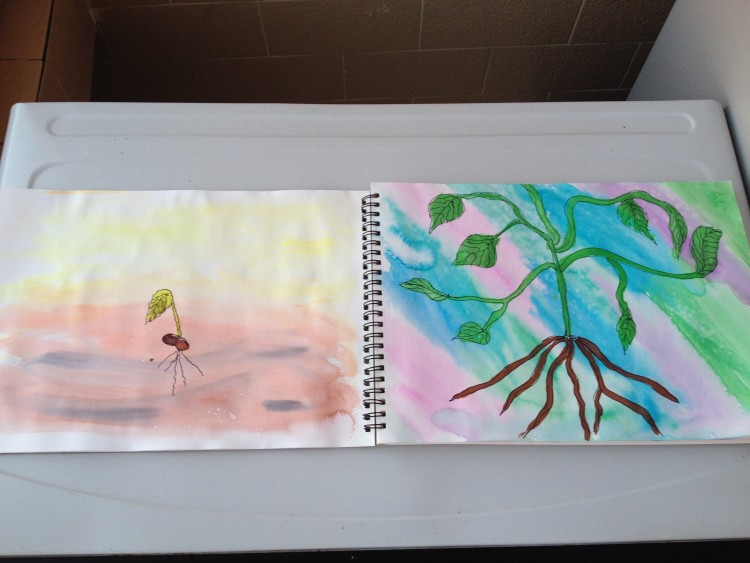
Locate an element on the screen. The width and height of the screenshot is (750, 563). wall is located at coordinates (696, 74).